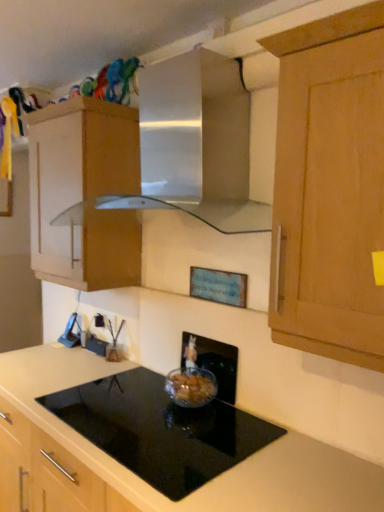
Identify the location of free point below satin silver vent at upper center (from a real-world perspective). This screenshot has width=384, height=512. (173, 414).